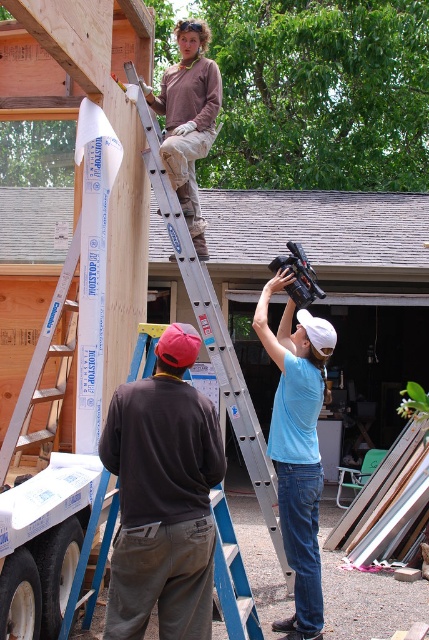
You are a construction worker who needs to place a new tool box on the ground near the dark gray sweatshirt at lower left. However, you must ensure it doesn not block the view of the gray shingles at upper center. Based on their positions, is this placement possible?

The dark gray sweatshirt at lower left is below the gray shingles at upper center, so placing the tool box near the dark gray sweatshirt at lower left would not block the view of the gray shingles at upper center since it is positioned lower down.

You are a construction worker who needs to place a new gray shingle onto the roof. You see the gray shingles at upper center and the silver metallic ladder at upper center. Which object is closer to you, the worker, so you can reach the shingles?

The gray shingles at upper center are closer to you than the silver metallic ladder at upper center, so you can reach them first.